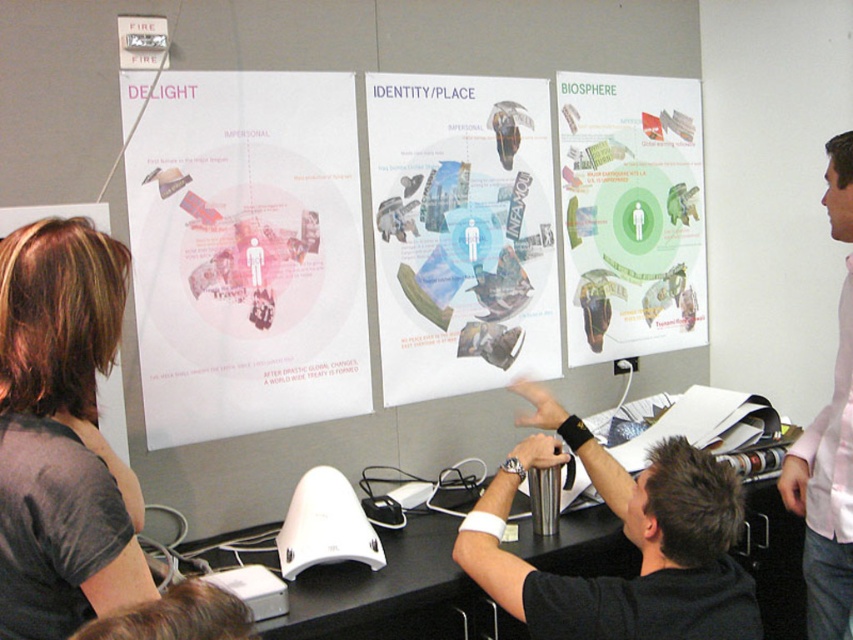
You are standing in front of the three posters displayed on the wall. You want to take a photo of the point at coordinates point (386, 605) without moving closer than 5 feet from the posters. Is the distance sufficient?

The distance of point (386, 605) from the camera is 5.39 feet, which is more than 5 feet, so you can take the photo without moving closer.

You are organizing a small event and need to place a 1.2 meter wide decorative panel on one of the objects. Which object between the black glossy table at center and the pink cotton shirt at right can accommodate the panel without exceeding its width?

The black glossy table at center has a larger width than the pink cotton shirt at right, so the decorative panel can be placed on the black glossy table at center.